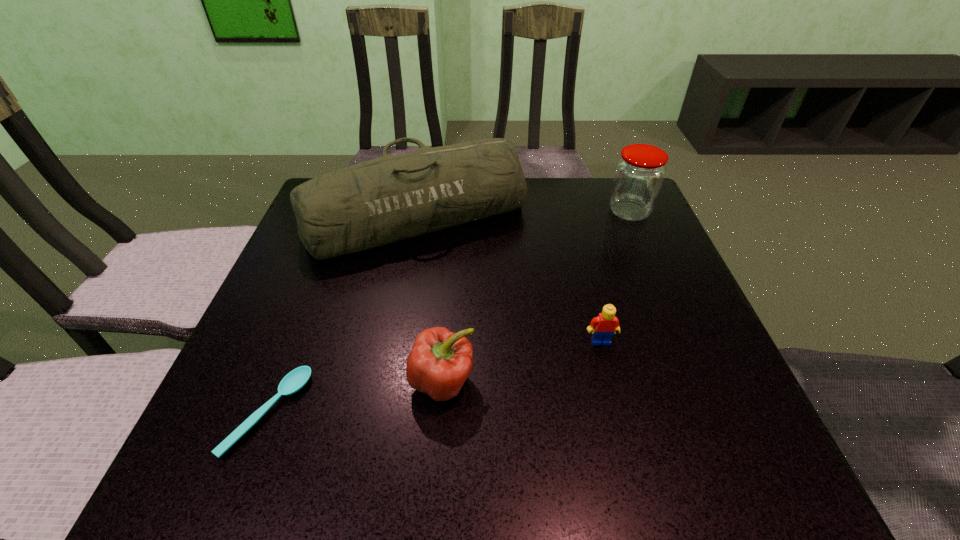
Where is `duffel bag`? Image resolution: width=960 pixels, height=540 pixels. duffel bag is located at coordinates (374, 203).

Where is `jar`? This screenshot has height=540, width=960. jar is located at coordinates (639, 175).

Identify the location of the third shortest object. (440, 361).

Identify the location of the second shortest object. (606, 323).

At what (x,y) coordinates should I click in order to perform the action: click on the third nearest object. Please return your answer as a coordinate pair (x, y). The image size is (960, 540). Looking at the image, I should click on (606, 323).

Identify the location of the shortest object. This screenshot has width=960, height=540. (296, 379).

Where is `vacant space located 0.320m on the front of the duffel bag`? vacant space located 0.320m on the front of the duffel bag is located at coordinates (384, 392).

Where is `vacant space situated 0.270m on the front of the rightmost object`? vacant space situated 0.270m on the front of the rightmost object is located at coordinates pos(669,304).

Identify the location of free space located 0.350m on the right of the third tallest object. The image size is (960, 540). (678, 381).

Find the location of a particular element. vacant space located 0.180m on the face of the Lego is located at coordinates (625, 437).